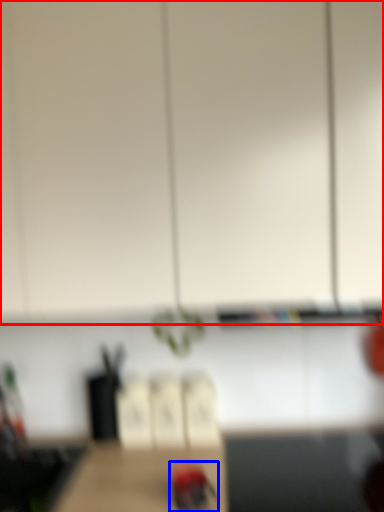
Question: Among these objects, which one is nearest to the camera, cabinetry (highlighted by a red box) or woodpecker (highlighted by a blue box)?

Choices:
 (A) cabinetry
 (B) woodpecker

Answer: (A)